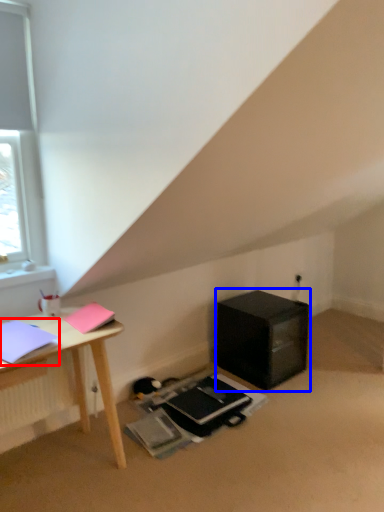
Question: Among these objects, which one is nearest to the camera, notebook (highlighted by a red box) or nightstand (highlighted by a blue box)?

Choices:
 (A) notebook
 (B) nightstand

Answer: (A)